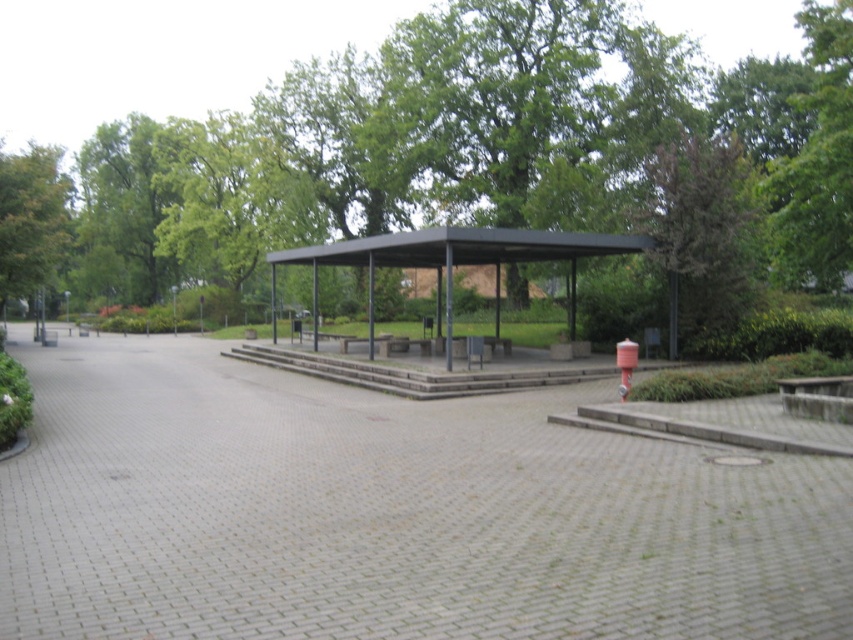
Question: Can you confirm if gray brick path at center is positioned above green leafy tree at center?

Choices:
 (A) no
 (B) yes

Answer: (A)

Question: Which object appears farthest from the camera in this image?

Choices:
 (A) green leafy tree at left
 (B) metallic structure at center

Answer: (A)

Question: Can you confirm if metallic structure at center is positioned to the left of metallic hydrant at lower right?

Choices:
 (A) no
 (B) yes

Answer: (B)

Question: Which point is farther to the camera?

Choices:
 (A) [9, 209]
 (B) [634, 362]
 (C) [216, 440]
 (D) [128, 241]

Answer: (D)

Question: Which point is closer to the camera?

Choices:
 (A) (38, 397)
 (B) (618, 353)
 (C) (373, 268)
 (D) (456, 196)

Answer: (B)

Question: Is gray brick path at center below green leafy tree at left?

Choices:
 (A) yes
 (B) no

Answer: (A)